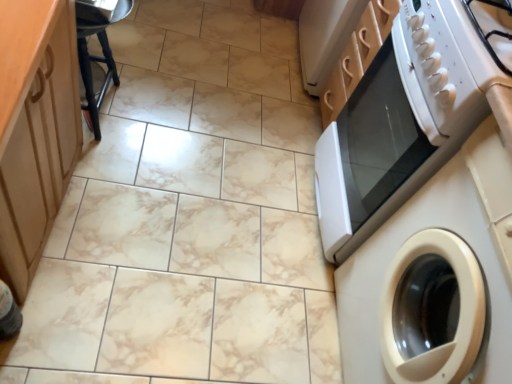
Question: Visually, is white glossy washing machine at right positioned to the left or to the right of white glossy gas stove at upper right?

Choices:
 (A) left
 (B) right

Answer: (B)

Question: Relative to white glossy gas stove at upper right, is white glossy washing machine at right in front or behind?

Choices:
 (A) front
 (B) behind

Answer: (A)

Question: Which of these objects is positioned closest to the black plastic bar stool at upper left?

Choices:
 (A) white glossy washing machine at right
 (B) white glossy microwave at upper right
 (C) white glossy gas stove at upper right

Answer: (B)

Question: Which object is positioned farthest from the white glossy gas stove at upper right?

Choices:
 (A) black plastic bar stool at upper left
 (B) white glossy microwave at upper right
 (C) white glossy washing machine at right

Answer: (A)